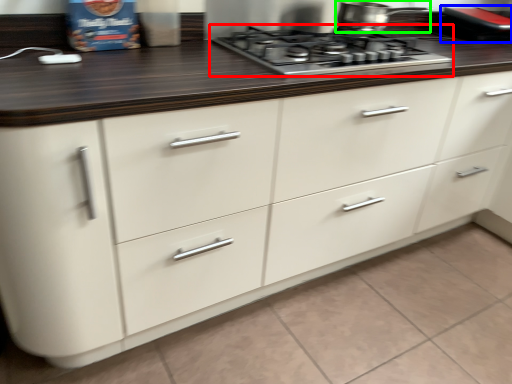
Question: Considering the real-world distances, which object is farthest from gas stove (highlighted by a red box)? appliance (highlighted by a blue box) or kitchen appliance (highlighted by a green box)?

Choices:
 (A) appliance
 (B) kitchen appliance

Answer: (A)